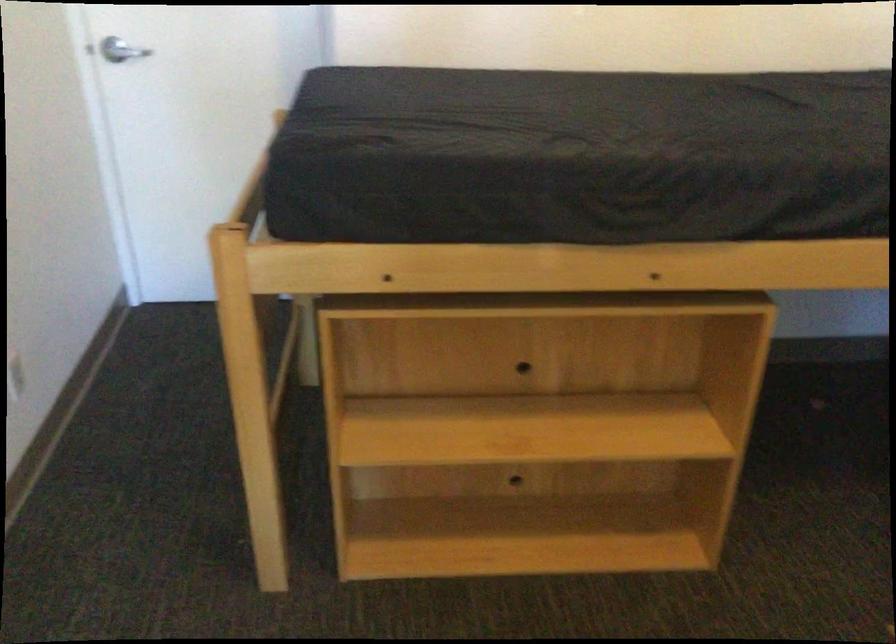
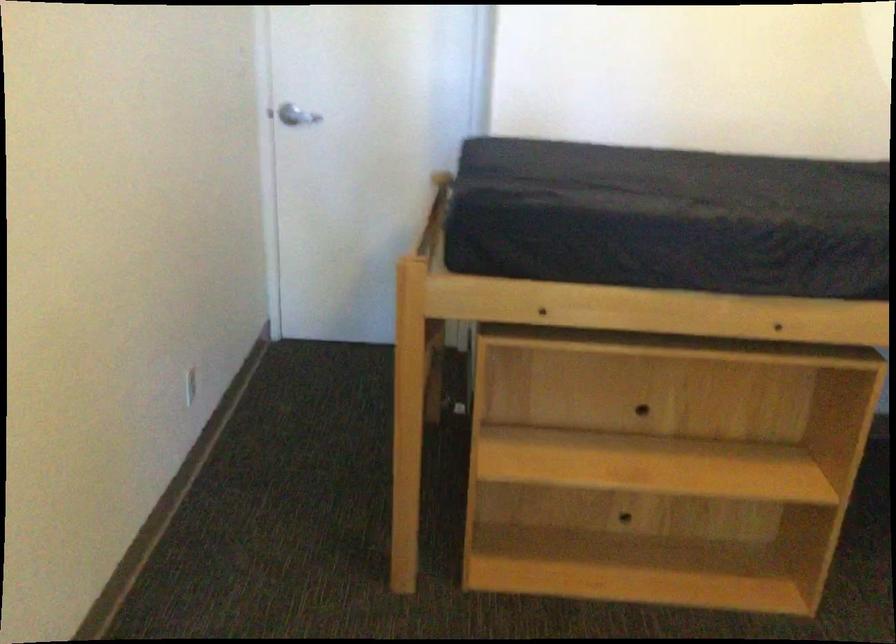
Find the pixel in the second image that matches (x=512, y=354) in the first image.

(633, 395)